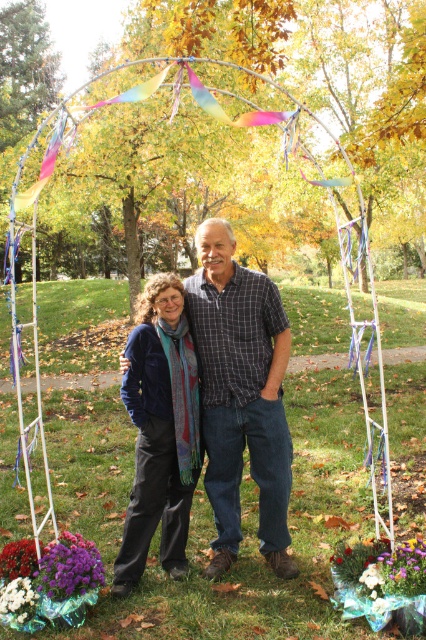
You are a photographer trying to capture both the dark blue jeans at center and the purple matte flower at lower left in a single frame. Based on their sizes, which object will appear bigger in the photo?

The dark blue jeans at center will appear bigger in the photo since it is larger in size than the purple matte flower at lower left.

You are a gardener who needs to water the purple matte flower at lower left and the white fluffy flowers at lower left. Since both are at the lower left, how can you distinguish their positions to water them properly?

The purple matte flower at lower left is located above the white fluffy flowers at lower left, so you should water the purple one first by aiming slightly higher and then lower for the white fluffy flowers.

You are standing at the entrance of the park and see the dark blue jeans at center and the purple matte flower at lower left. Which object is closer to you?

The dark blue jeans at center is closer to you because it is further to the viewer than the purple matte flower at lower left.